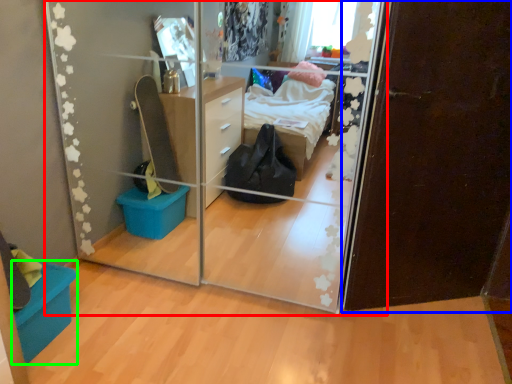
Question: Considering the real-world distances, which object is farthest from glass door (highlighted by a red box)? door (highlighted by a blue box) or storage box (highlighted by a green box)?

Choices:
 (A) door
 (B) storage box

Answer: (B)